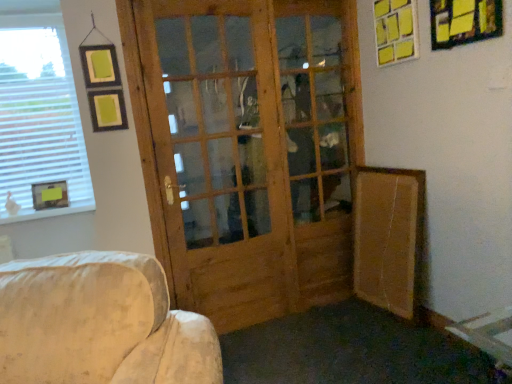
Question: Is brown cardboard at lower right with natural wood screen door at center?

Choices:
 (A) yes
 (B) no

Answer: (B)

Question: From a real-world perspective, is brown cardboard at lower right physically below natural wood screen door at center?

Choices:
 (A) no
 (B) yes

Answer: (B)

Question: Considering the relative positions of brown cardboard at lower right and natural wood screen door at center in the image provided, is brown cardboard at lower right to the right of natural wood screen door at center from the viewer's perspective?

Choices:
 (A) no
 (B) yes

Answer: (B)

Question: Can you confirm if brown cardboard at lower right is wider than natural wood screen door at center?

Choices:
 (A) yes
 (B) no

Answer: (A)

Question: Does brown cardboard at lower right have a smaller size compared to natural wood screen door at center?

Choices:
 (A) no
 (B) yes

Answer: (B)

Question: Looking at their shapes, would you say yellow paper picture frame at upper right, marked as the 2th picture frame in a front-to-back arrangement, is wider or thinner than natural wood screen door at center?

Choices:
 (A) thin
 (B) wide

Answer: (A)

Question: Based on their positions, is yellow paper picture frame at upper right, which is the second picture frame in left-to-right order, located to the left or right of natural wood screen door at center?

Choices:
 (A) right
 (B) left

Answer: (A)

Question: From their relative heights in the image, would you say yellow paper picture frame at upper right, marked as the 2th picture frame in a front-to-back arrangement, is taller or shorter than natural wood screen door at center?

Choices:
 (A) tall
 (B) short

Answer: (B)

Question: Based on their sizes in the image, would you say yellow paper picture frame at upper right, the 1th picture frame from the top, is bigger or smaller than natural wood screen door at center?

Choices:
 (A) small
 (B) big

Answer: (A)

Question: In terms of height, does yellow paper picture frame at upper right, positioned as the 1th picture frame in front-to-back order, look taller or shorter compared to white blinds at left?

Choices:
 (A) tall
 (B) short

Answer: (B)

Question: In terms of width, does yellow paper picture frame at upper right, placed as the 1th picture frame when sorted from right to left, look wider or thinner when compared to white blinds at left?

Choices:
 (A) wide
 (B) thin

Answer: (A)

Question: Considering the positions of point (496, 16) and point (4, 124), is point (496, 16) closer or farther from the camera than point (4, 124)?

Choices:
 (A) farther
 (B) closer

Answer: (B)

Question: Choose the correct answer: Is yellow paper picture frame at upper right, positioned as the 1th picture frame in front-to-back order, inside white blinds at left or outside it?

Choices:
 (A) outside
 (B) inside

Answer: (A)

Question: Is yellow paper picture frame at upper right, positioned as the second picture frame in bottom-to-top order, wider or thinner than wooden picture frame at left, which ranks as the 3th picture frame in right-to-left order?

Choices:
 (A) thin
 (B) wide

Answer: (A)

Question: Do you think yellow paper picture frame at upper right, positioned as the 1th picture frame in front-to-back order, is within wooden picture frame at left, the first picture frame positioned from the bottom, or outside of it?

Choices:
 (A) outside
 (B) inside

Answer: (A)